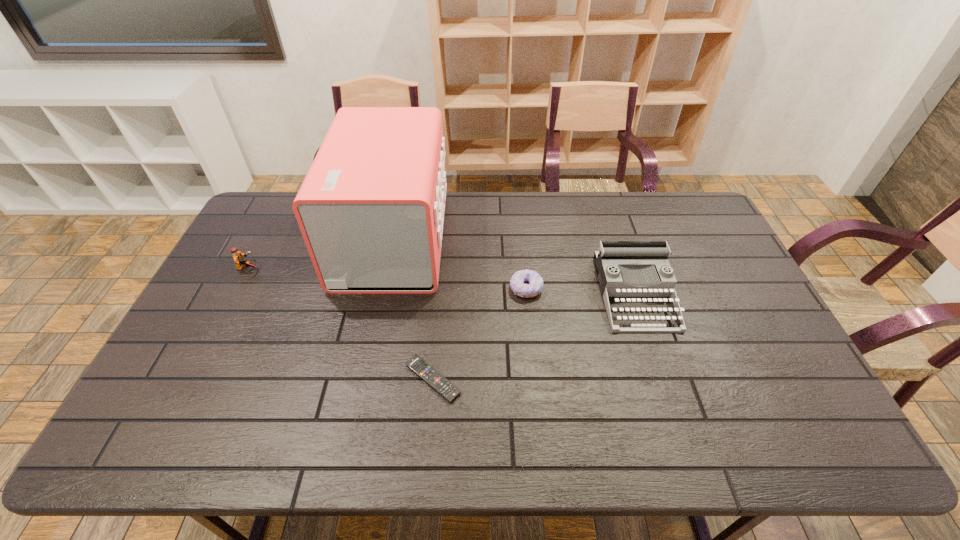
Find the location of a particular element. free space located 0.110m on the typing side of the rightmost object is located at coordinates (660, 366).

You are a GUI agent. You are given a task and a screenshot of the screen. Output one action in this format:
    pyautogui.click(x=<x>, y=<y>)
    Task: Click on the free location located 0.070m holding a crossbow in the hands of the third shortest object
    The width and height of the screenshot is (960, 540).
    Given the screenshot: What is the action you would take?
    pyautogui.click(x=281, y=269)

I want to click on vacant space located 0.370m on the right of the doughnut, so (x=662, y=288).

Locate an element on the screen. free space located on the left of the nearest object is located at coordinates (311, 379).

The image size is (960, 540). Find the location of `object situated at the far edge`. object situated at the far edge is located at coordinates (371, 208).

Image resolution: width=960 pixels, height=540 pixels. What are the coordinates of `object that is at the left edge` in the screenshot? It's located at (238, 258).

Identify the location of free space at the far edge. The height and width of the screenshot is (540, 960). (650, 219).

At what (x,y) coordinates should I click in order to perform the action: click on vacant space at the near edge. Please return your answer as a coordinate pair (x, y). Looking at the image, I should click on (646, 431).

The width and height of the screenshot is (960, 540). In the image, there is a desktop. Find the location of `vacant space at the left edge`. vacant space at the left edge is located at coordinates (224, 271).

Find the location of a particular element. vacant region at the right edge is located at coordinates (804, 388).